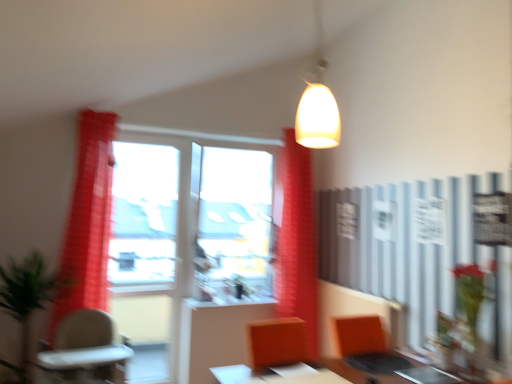
What is the approximate height of red sheer curtain at left, the 2th curtain positioned from the right?

1.78 meters.

Identify the location of red fabric curtain at center, which ranks as the 1th curtain in right-to-left order. (297, 241).

Measure the distance between point (270, 208) and camera.

Point (270, 208) and camera are 3.83 meters apart.

This screenshot has height=384, width=512. In order to click on transparent glass window at center, which is the second window screen from left to right in this screenshot , I will do `click(234, 226)`.

This screenshot has height=384, width=512. Describe the element at coordinates (26, 300) in the screenshot. I see `green leafy plant at left, the 2th plant when ordered from right to left` at that location.

The image size is (512, 384). I want to click on green leafy plant at left, arranged as the 1th plant when viewed from the left, so click(26, 300).

I want to click on orange fabric armchair at lower right, so click(366, 347).

From the image's perspective, is transparent glass window at center, which ranks as the first window screen in right-to-left order, located beneath red sheer curtain at left, the 2th curtain positioned from the right?

Incorrect, from the image's perspective, transparent glass window at center, which ranks as the first window screen in right-to-left order, is higher than red sheer curtain at left, the 2th curtain positioned from the right.

From a real-world perspective, between transparent glass window at center, which is the second window screen from left to right, and red sheer curtain at left, the 2th curtain positioned from the right, who is vertically higher?

transparent glass window at center, which is the second window screen from left to right.

From the picture: Which point is more distant from viewer, (250, 155) or (85, 264)?

The point (250, 155) is more distant.

Is green leafy plant at left, the 2th plant when ordered from right to left, aimed at white glossy table at center, which is the second table from right to left?

No.

Are green leafy plant at left, arranged as the 1th plant when viewed from the left, and white glossy table at center, which is the second table from right to left, beside each other?

No.

Can you confirm if green leafy plant at left, arranged as the 1th plant when viewed from the left, is shorter than white glossy table at center, which is the second table from right to left?

In fact, green leafy plant at left, arranged as the 1th plant when viewed from the left, may be taller than white glossy table at center, which is the second table from right to left.

Considering the sizes of objects green leafy plant at left, the 2th plant when ordered from right to left, and white glossy table at center, which is the second table from right to left, in the image provided, who is thinner, green leafy plant at left, the 2th plant when ordered from right to left, or white glossy table at center, which is the second table from right to left,?

With smaller width is white glossy table at center, which is the second table from right to left.

Which of these two, red fabric curtain at center, acting as the 2th curtain starting from the front, or green matte plant at center, which is the 2th plant in left-to-right order, stands shorter?

With less height is green matte plant at center, which is the 2th plant in left-to-right order.

Which is behind, point (287, 165) or point (234, 294)?

The point (234, 294) is farther.

Is red fabric curtain at center, which ranks as the 1th curtain in right-to-left order, positioned with its back to green matte plant at center, which is the 1th plant from right to left?

No, red fabric curtain at center, which ranks as the 1th curtain in right-to-left order,'s orientation is not away from green matte plant at center, which is the 1th plant from right to left.

Does red fabric curtain at center, which ranks as the 1th curtain in right-to-left order, have a smaller size compared to green matte plant at center, marked as the 2th plant in a front-to-back arrangement?

Incorrect, red fabric curtain at center, which ranks as the 1th curtain in right-to-left order, is not smaller in size than green matte plant at center, marked as the 2th plant in a front-to-back arrangement.

In order to click on plant on the right of the green leafy plant at left, the 2th plant when ordered from right to left in this screenshot , I will do `click(237, 286)`.

Is point (13, 318) closer or farther from the camera than point (227, 279)?

Clearly, point (13, 318) is closer to the camera than point (227, 279).

Is green leafy plant at left, arranged as the 1th plant when viewed from the left, thinner than green matte plant at center, which is the first plant in back-to-front order?

No.

Considering the sizes of objects green leafy plant at left, arranged as the 1th plant when viewed from the left, and green matte plant at center, which is the first plant in back-to-front order, in the image provided, who is shorter, green leafy plant at left, arranged as the 1th plant when viewed from the left, or green matte plant at center, which is the first plant in back-to-front order,?

green matte plant at center, which is the first plant in back-to-front order.

Is transparent glass window at center, which ranks as the first window screen in right-to-left order, turned away from red fabric curtain at center, acting as the 2th curtain starting from the front?

transparent glass window at center, which ranks as the first window screen in right-to-left order, does not have its back to red fabric curtain at center, acting as the 2th curtain starting from the front.

Which point is more distant from viewer, (210, 198) or (314, 312)?

Positioned behind is point (210, 198).

Does transparent glass window at center, which ranks as the first window screen in right-to-left order, appear on the left side of red fabric curtain at center, which ranks as the 1th curtain in right-to-left order?

Yes.

Considering the sizes of objects transparent glass window at center, which ranks as the first window screen in right-to-left order, and red fabric curtain at center, acting as the 2th curtain starting from the front, in the image provided, who is shorter, transparent glass window at center, which ranks as the first window screen in right-to-left order, or red fabric curtain at center, acting as the 2th curtain starting from the front,?

Standing shorter between the two is transparent glass window at center, which ranks as the first window screen in right-to-left order.

Is green matte plant at center, which is the 1th plant from right to left, looking in the opposite direction of metallic silver table at center, which is counted as the second table, starting from the left?

No, green matte plant at center, which is the 1th plant from right to left, is not facing away from metallic silver table at center, which is counted as the second table, starting from the left.

Which of these two, green matte plant at center, which is the 2th plant in left-to-right order, or metallic silver table at center, acting as the first table starting from the right, stands taller?

Standing taller between the two is green matte plant at center, which is the 2th plant in left-to-right order.

Would you say metallic silver table at center, which is counted as the second table, starting from the left, is part of green matte plant at center, which is the first plant in back-to-front order,'s contents?

Actually, metallic silver table at center, which is counted as the second table, starting from the left, is outside green matte plant at center, which is the first plant in back-to-front order.

Considering their positions, is green matte plant at center, which is the first plant in back-to-front order, located in front of or behind metallic silver table at center, which is counted as the second table, starting from the left?

In the image, green matte plant at center, which is the first plant in back-to-front order, appears behind metallic silver table at center, which is counted as the second table, starting from the left.

Could red sheer curtain at left, the 2th curtain positioned from the right, be considered to be inside green leafy plant at left, which appears as the second plant when viewed from the back?

No, green leafy plant at left, which appears as the second plant when viewed from the back, does not contain red sheer curtain at left, the 2th curtain positioned from the right.

In the image, is green leafy plant at left, which appears as the second plant when viewed from the back, positioned in front of or behind red sheer curtain at left, which is the second curtain from back to front?

Visually, green leafy plant at left, which appears as the second plant when viewed from the back, is located in front of red sheer curtain at left, which is the second curtain from back to front.

Considering the points (35, 295) and (94, 202), which point is in front, point (35, 295) or point (94, 202)?

The point (35, 295) is closer to the camera.

Does green leafy plant at left, arranged as the 1th plant when viewed from the left, have a smaller size compared to red sheer curtain at left, the first curtain positioned from the front?

Incorrect, green leafy plant at left, arranged as the 1th plant when viewed from the left, is not smaller in size than red sheer curtain at left, the first curtain positioned from the front.

From the transparent glass window at center, which ranks as the first window screen in right-to-left order, count 2nd curtains forward and point to it. Please provide its 2D coordinates.

[(87, 223)]

The height and width of the screenshot is (384, 512). I want to click on plant that is the 2nd one when counting leftward from the white glossy table at center, the 1th table when ordered from left to right, so click(x=26, y=300).

Which object lies nearer to the anchor point transparent glass window at left, positioned as the 1th window screen in left-to-right order, green matte plant at center, which is the first plant in back-to-front order, or red fabric curtain at center, the second curtain from the left?

green matte plant at center, which is the first plant in back-to-front order.

Considering their positions, is orange fabric armchair at lower right positioned closer to red sheer curtain at left, which is the second curtain from back to front, than beige plastic chair at lower left?

Among the two, beige plastic chair at lower left is located nearer to red sheer curtain at left, which is the second curtain from back to front.

Considering their positions, is orange fabric armchair at lower right positioned further to red sheer curtain at left, the 2th curtain positioned from the right, than metallic silver table at center, acting as the first table starting from the right?

Based on the image, metallic silver table at center, acting as the first table starting from the right, appears to be further to red sheer curtain at left, the 2th curtain positioned from the right.

Looking at the image, which one is located further to transparent glass window at center, which is the second window screen from left to right, green leafy plant at left, which appears as the second plant when viewed from the back, or red fabric curtain at center, acting as the 2th curtain starting from the front?

green leafy plant at left, which appears as the second plant when viewed from the back, is further to transparent glass window at center, which is the second window screen from left to right.

From the picture: Looking at the image, which one is located closer to green leafy plant at left, arranged as the 1th plant when viewed from the left, transparent glass window at left, which is the second window screen from right to left, or red fabric curtain at center, the second curtain from the left?

Among the two, transparent glass window at left, which is the second window screen from right to left, is located nearer to green leafy plant at left, arranged as the 1th plant when viewed from the left.

When comparing their distances from red sheer curtain at left, the 2th curtain positioned from the right, does green matte plant at center, which is the first plant in back-to-front order, or beige plastic chair at lower left seem further?

green matte plant at center, which is the first plant in back-to-front order.

From the image, which object appears to be nearer to red sheer curtain at left, the first curtain positioned from the front, green leafy plant at left, arranged as the 1th plant when viewed from the left, or green matte plant at center, which is the first plant in back-to-front order?

green leafy plant at left, arranged as the 1th plant when viewed from the left, is closer to red sheer curtain at left, the first curtain positioned from the front.

Considering their positions, is green matte plant at center, which is the 1th plant from right to left, positioned further to transparent glass window at left, positioned as the 1th window screen in left-to-right order, than orange fabric armchair at lower right?

Based on the image, orange fabric armchair at lower right appears to be further to transparent glass window at left, positioned as the 1th window screen in left-to-right order.

I want to click on table between green leafy plant at left, the 2th plant when ordered from right to left, and orange fabric armchair at lower right, in the horizontal direction, so click(x=276, y=376).

You are a GUI agent. You are given a task and a screenshot of the screen. Output one action in this format:
    pyautogui.click(x=<x>, y=<y>)
    Task: Click on the curtain between red sheer curtain at left, the first curtain positioned from the front, and orange fabric armchair at lower right
    The image size is (512, 384).
    Given the screenshot: What is the action you would take?
    pyautogui.click(x=297, y=241)

I want to click on chair between matte white pendant light at upper center and transparent glass window at center, which is the second window screen from left to right, along the z-axis, so 86,350.

Where is `window screen located between white glossy table at center, the 1th table when ordered from left to right, and transparent glass window at center, which ranks as the first window screen in right-to-left order, in the depth direction`? The height and width of the screenshot is (384, 512). window screen located between white glossy table at center, the 1th table when ordered from left to right, and transparent glass window at center, which ranks as the first window screen in right-to-left order, in the depth direction is located at coordinates [x=144, y=214].